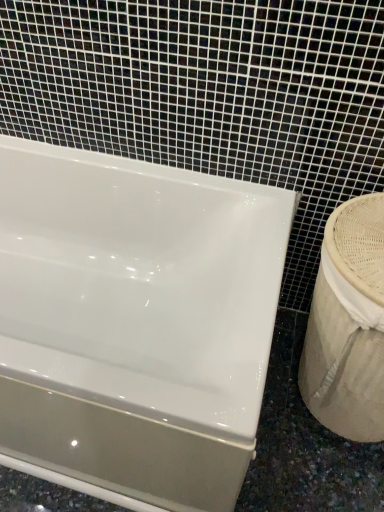
Question: Is white glossy sink at right in front of or behind glossy ceramic bathtub at upper left in the image?

Choices:
 (A) behind
 (B) front

Answer: (A)

Question: Is white glossy sink at right wider or thinner than glossy ceramic bathtub at upper left?

Choices:
 (A) wide
 (B) thin

Answer: (B)

Question: Is point (367, 424) closer or farther from the camera than point (173, 223)?

Choices:
 (A) farther
 (B) closer

Answer: (B)

Question: Based on their sizes in the image, would you say glossy ceramic bathtub at upper left is bigger or smaller than white glossy sink at right?

Choices:
 (A) big
 (B) small

Answer: (A)

Question: Is glossy ceramic bathtub at upper left situated inside white glossy sink at right or outside?

Choices:
 (A) outside
 (B) inside

Answer: (A)

Question: From a real-world perspective, is glossy ceramic bathtub at upper left physically located above or below white glossy sink at right?

Choices:
 (A) above
 (B) below

Answer: (B)

Question: In terms of height, does glossy ceramic bathtub at upper left look taller or shorter compared to white glossy sink at right?

Choices:
 (A) tall
 (B) short

Answer: (B)